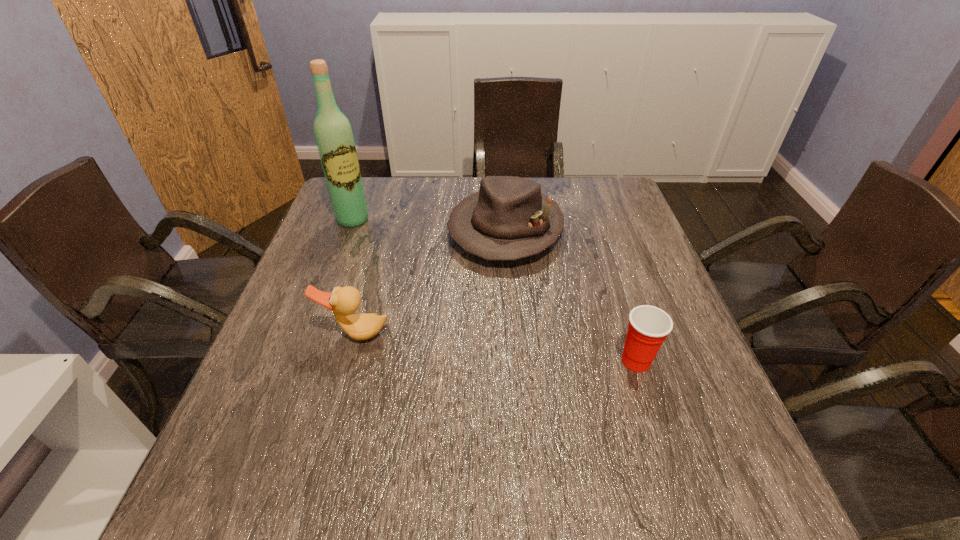
I want to click on vacant space that satisfies the following two spatial constraints: 1. on the beak of the nearest object; 2. on the right side of the duck, so click(x=348, y=361).

Where is `vacant area in the image that satisfies the following two spatial constraints: 1. on the front side of the tallest object; 2. on the left side of the rightmost object`? vacant area in the image that satisfies the following two spatial constraints: 1. on the front side of the tallest object; 2. on the left side of the rightmost object is located at coordinates (300, 361).

The height and width of the screenshot is (540, 960). What are the coordinates of `vacant space that satisfies the following two spatial constraints: 1. on the beak of the third farthest object; 2. on the right side of the Dixie cup` in the screenshot? It's located at (348, 361).